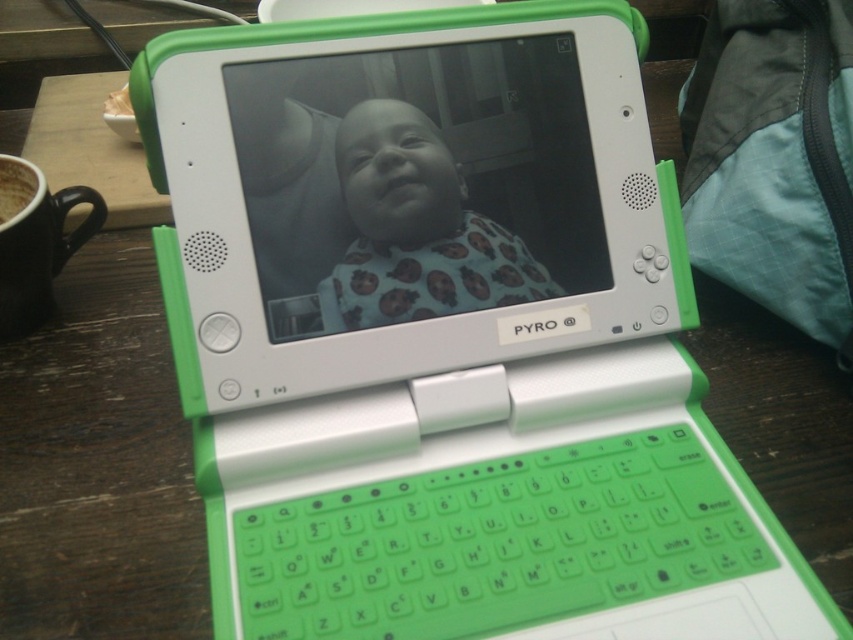
You are a teacher organizing a classroom. You have a matte plastic screen at center and a brown matte cup at upper left. Which object is positioned more to the left?

The brown matte cup at upper left is positioned more to the left than the matte plastic screen at center.

You are a parent trying to secure your child with a blue fabric bib at center while they use the laptop. The matte plastic screen at center is in the way. Can you move the bib closer to the screen without overlapping them?

The matte plastic screen at center and blue fabric bib at center are 1.95 centimeters apart from each other. Since they are already separated by nearly 2 centimeters, you can move the bib closer to the screen as long as the distance remains at least 0.5 centimeters to prevent overlapping. However, the exact maximum allowable distance before overlapping isnecessary to know the size of the bib and screen. Without that information, it is safer to assume that reducing the distance to around 1 centimeter wouldbe